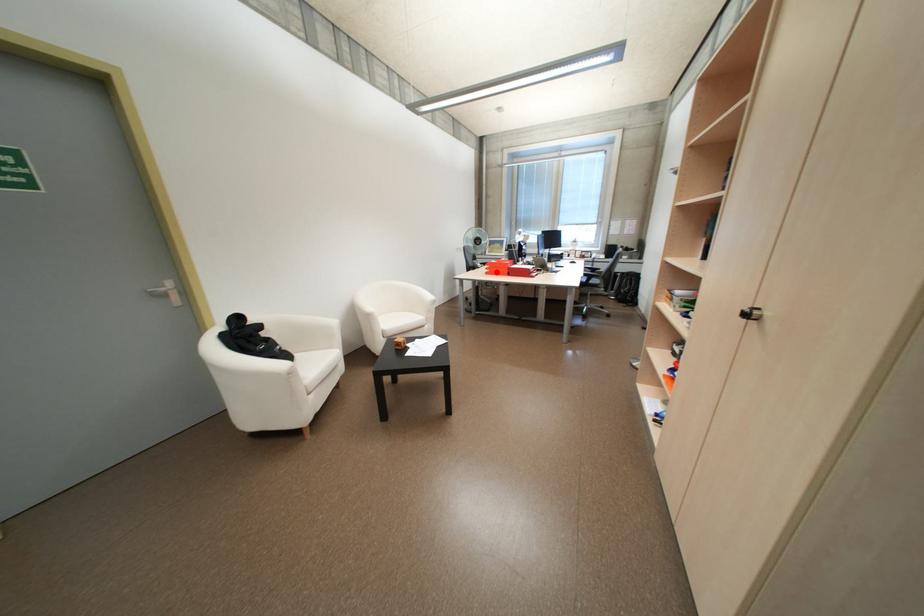
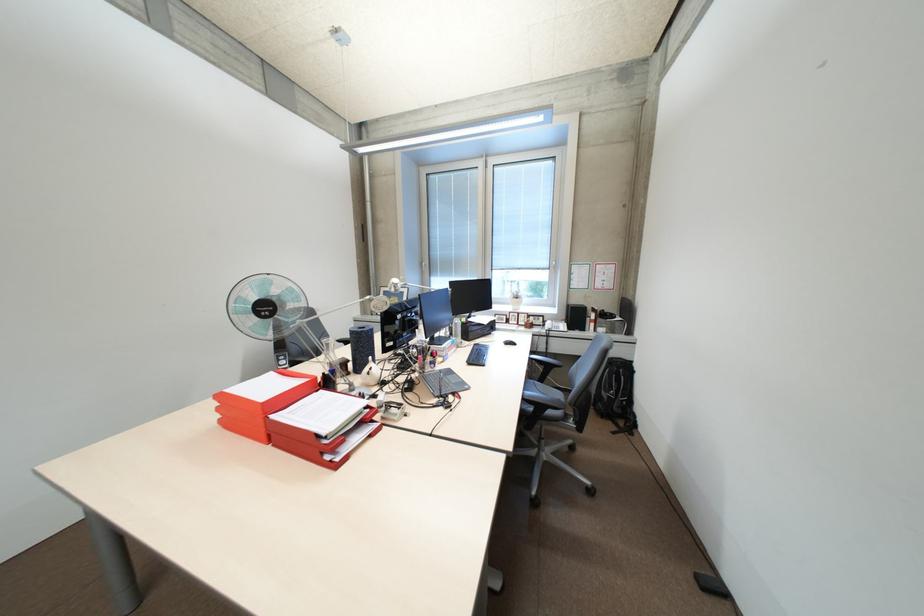
Where in the second image is the point corresponding to the highlighted location from the first image?

(231, 421)